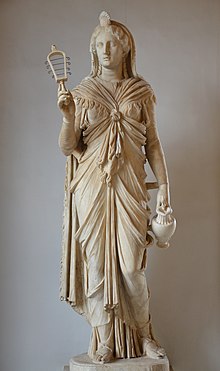
Image resolution: width=220 pixels, height=371 pixels. What are the coordinates of `jug` in the screenshot? It's located at (164, 232).